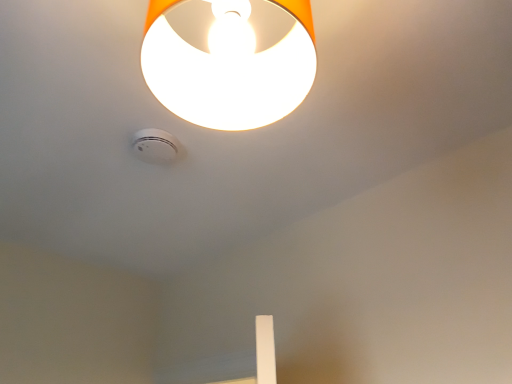
The width and height of the screenshot is (512, 384). What do you see at coordinates (229, 73) in the screenshot? I see `white matte lampshade at upper center` at bounding box center [229, 73].

You are a GUI agent. You are given a task and a screenshot of the screen. Output one action in this format:
    pyautogui.click(x=<x>, y=<y>)
    Task: Click on the white matte lampshade at upper center
    
    Given the screenshot: What is the action you would take?
    pyautogui.click(x=229, y=73)

What is the approximate width of white matte lampshade at upper center?

white matte lampshade at upper center is 10.68 inches wide.

Identify the location of white matte lampshade at upper center. This screenshot has width=512, height=384. (229, 73).